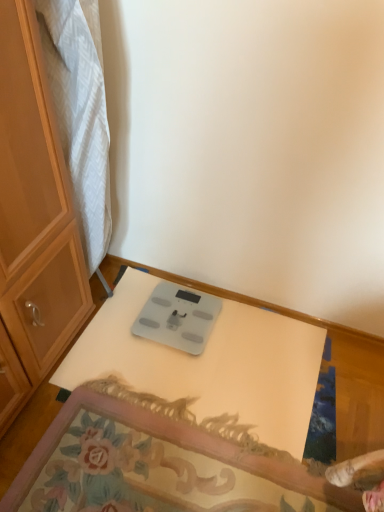
Question: From the image's perspective, does silver metallic scale at center appear higher than white glossy table at center?

Choices:
 (A) yes
 (B) no

Answer: (A)

Question: Are silver metallic scale at center and white glossy table at center making contact?

Choices:
 (A) no
 (B) yes

Answer: (A)

Question: Considering the relative sizes of silver metallic scale at center and white glossy table at center in the image provided, is silver metallic scale at center wider than white glossy table at center?

Choices:
 (A) yes
 (B) no

Answer: (B)

Question: Is silver metallic scale at center behind white glossy table at center?

Choices:
 (A) yes
 (B) no

Answer: (A)

Question: Can you confirm if silver metallic scale at center is positioned to the left of white glossy table at center?

Choices:
 (A) yes
 (B) no

Answer: (A)

Question: Relative to matte wood cabinet at left, is white glossy table at center in front or behind?

Choices:
 (A) behind
 (B) front

Answer: (B)

Question: Based on their positions, is white glossy table at center located to the left or right of matte wood cabinet at left?

Choices:
 (A) right
 (B) left

Answer: (A)

Question: In terms of width, does white glossy table at center look wider or thinner when compared to matte wood cabinet at left?

Choices:
 (A) thin
 (B) wide

Answer: (B)

Question: From a real-world perspective, is white glossy table at center physically located above or below matte wood cabinet at left?

Choices:
 (A) below
 (B) above

Answer: (A)

Question: In terms of size, does silver metallic scale at center appear bigger or smaller than matte wood cabinet at left?

Choices:
 (A) small
 (B) big

Answer: (A)

Question: Would you say silver metallic scale at center is to the left or to the right of matte wood cabinet at left in the picture?

Choices:
 (A) right
 (B) left

Answer: (A)

Question: From the image's perspective, relative to matte wood cabinet at left, is silver metallic scale at center above or below?

Choices:
 (A) above
 (B) below

Answer: (B)

Question: From a real-world perspective, is silver metallic scale at center positioned above or below matte wood cabinet at left?

Choices:
 (A) above
 (B) below

Answer: (B)

Question: Considering the positions of point (21, 387) and point (182, 296), is point (21, 387) closer or farther from the camera than point (182, 296)?

Choices:
 (A) closer
 (B) farther

Answer: (A)

Question: From the image's perspective, relative to silver metallic scale at center, is matte wood cabinet at left above or below?

Choices:
 (A) above
 (B) below

Answer: (A)